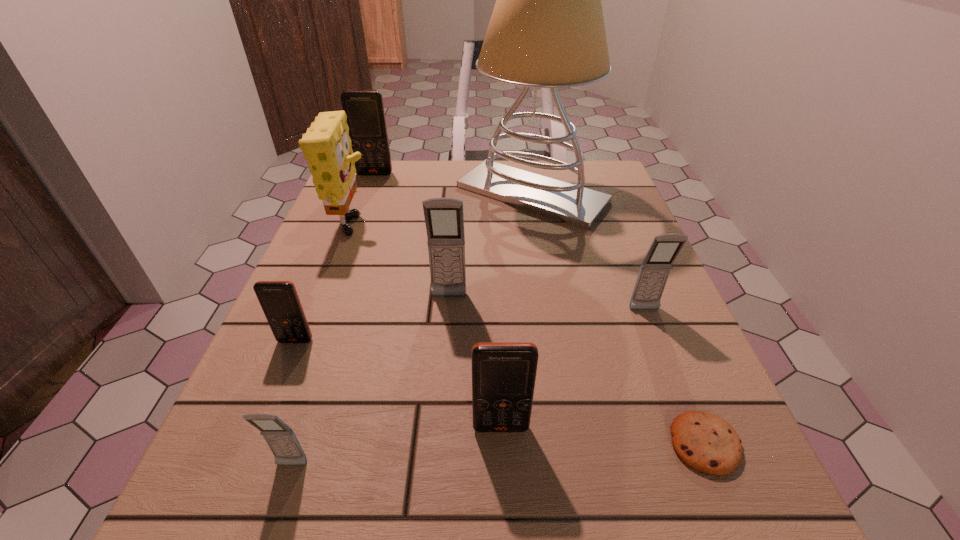
The width and height of the screenshot is (960, 540). I want to click on cookie situated at the right edge, so click(705, 442).

This screenshot has width=960, height=540. Find the location of `object at the far left corner`. object at the far left corner is located at coordinates (365, 113).

Locate an element on the screen. The width and height of the screenshot is (960, 540). object that is at the far right corner is located at coordinates (547, 30).

What are the coordinates of `free space at the far edge` in the screenshot? It's located at (428, 164).

This screenshot has width=960, height=540. In the image, there is a desktop. In order to click on vacant space at the left edge in this screenshot , I will do `click(383, 240)`.

In the image, there is a desktop. Where is `vacant space at the right edge`? The width and height of the screenshot is (960, 540). vacant space at the right edge is located at coordinates (647, 392).

Identify the location of free space at the far left corner of the desktop. (360, 205).

You are a GUI agent. You are given a task and a screenshot of the screen. Output one action in this format:
    pyautogui.click(x=<x>, y=<y>)
    Task: Click on the free space at the far right corner of the desktop
    The width and height of the screenshot is (960, 540).
    Given the screenshot: What is the action you would take?
    pyautogui.click(x=624, y=198)

Locate an element on the screen. This screenshot has width=960, height=540. vacant area that lies between the sponge and the second smallest orange cellular telephone is located at coordinates (426, 329).

The image size is (960, 540). In order to click on free space between the biggest gray cellular telephone and the shortest object in this screenshot , I will do `click(577, 370)`.